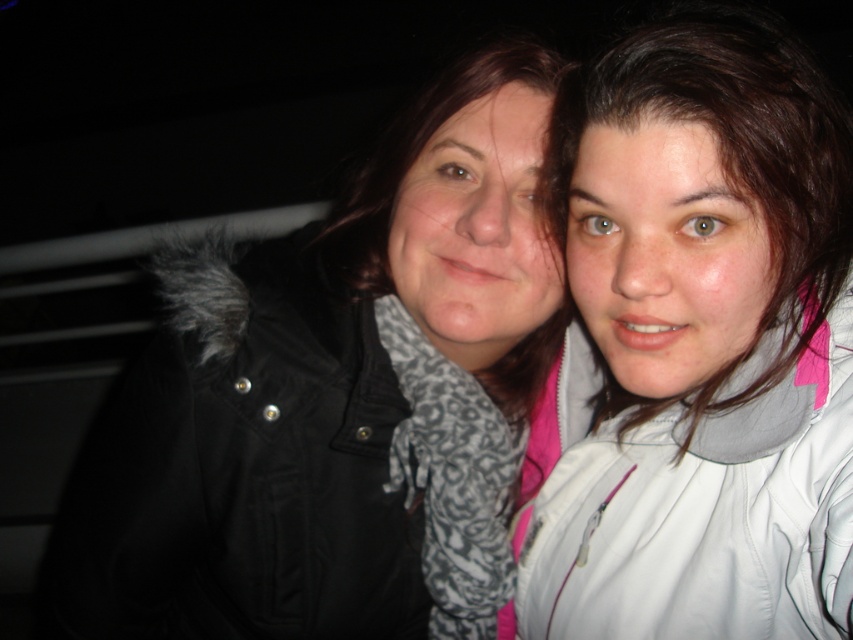
Question: Is black matte jacket at center smaller than white matte jacket at right?

Choices:
 (A) yes
 (B) no

Answer: (B)

Question: Which point is farther to the camera?

Choices:
 (A) (708, 346)
 (B) (241, 472)

Answer: (B)

Question: Which object is farther from the camera taking this photo?

Choices:
 (A) white matte jacket at right
 (B) black matte jacket at center

Answer: (B)

Question: Does black matte jacket at center have a smaller size compared to white matte jacket at right?

Choices:
 (A) no
 (B) yes

Answer: (A)

Question: Is black matte jacket at center closer to camera compared to white matte jacket at right?

Choices:
 (A) no
 (B) yes

Answer: (A)